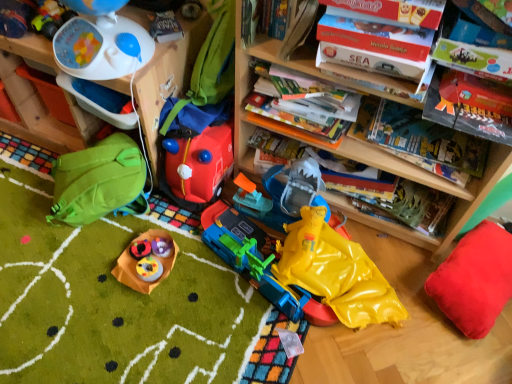
Question: In terms of width, does white plastic toy at upper left, acting as the 6th toy starting from the right, look wider or thinner when compared to rubberized plastic toy at center, the 3th toy when ordered from left to right?

Choices:
 (A) wide
 (B) thin

Answer: (A)

Question: From the image's perspective, is white plastic toy at upper left, the 2th toy viewed from the left, positioned above or below rubberized plastic toy at center, the 5th toy from the right?

Choices:
 (A) above
 (B) below

Answer: (A)

Question: Based on their relative distances, which object is farther from the white plastic toy at upper left, acting as the 6th toy starting from the right?

Choices:
 (A) red plush pillow at lower right
 (B) hardcover book at upper center, which is the 2th book from back to front
 (C) green fabric backpack at lower left
 (D) rubberized red backpack at center, the 2th toy from the right
 (E) rubberized plastic toy at center, positioned as the 4th toy in right-to-left order

Answer: (A)

Question: Estimate the real-world distances between objects in this image. Which object is farther from the hardcover book at upper center, which is the 2th book from back to front?

Choices:
 (A) rubberized plastic toy at center, the 5th toy from the right
 (B) hardcover book at center, the first book in the back-to-front sequence
 (C) yellow rubber raincoat at lower center, which ranks as the seventh toy in left-to-right order
 (D) wooden bookcase at upper center
 (E) white plastic toy at upper left, acting as the 6th toy starting from the right

Answer: (A)